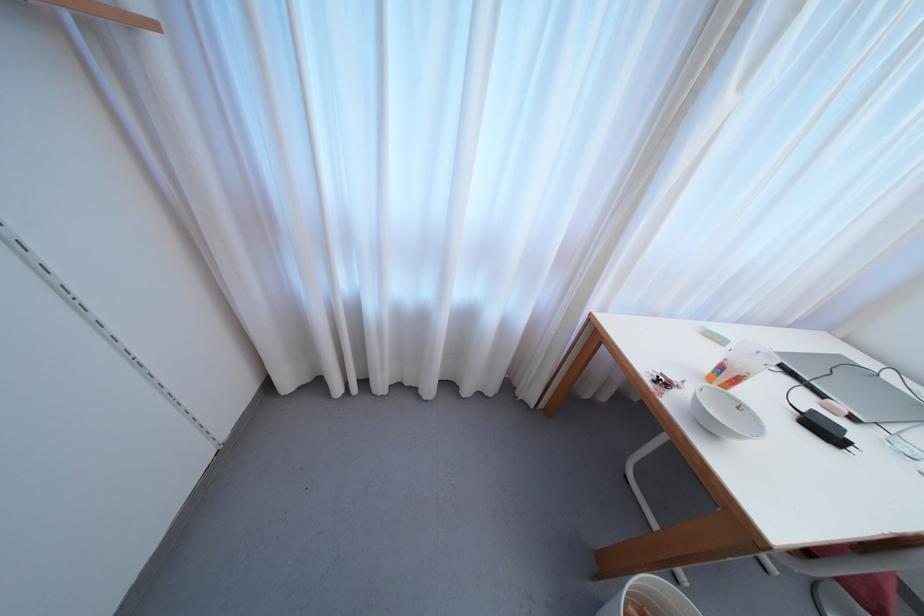
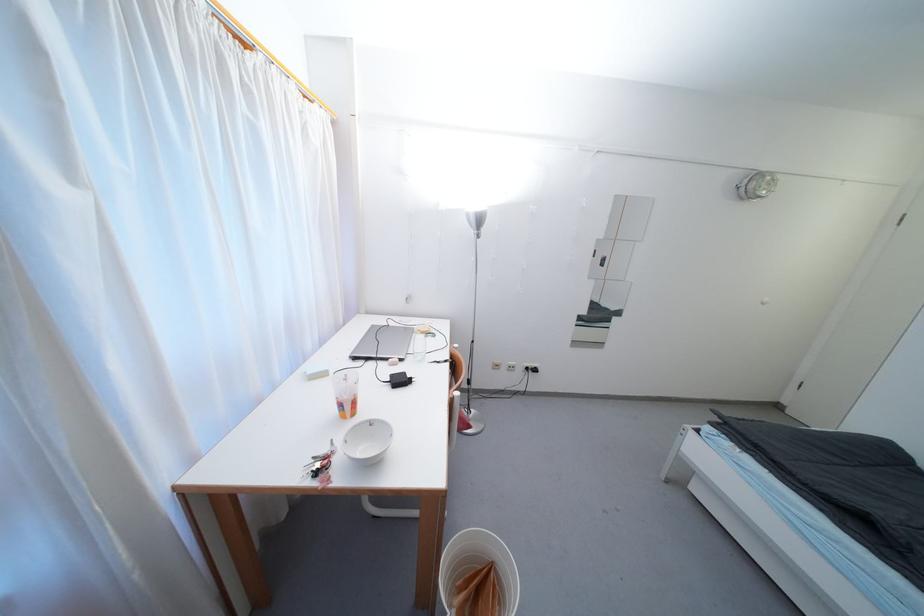
The images are taken continuously from a first-person perspective. In which direction is your viewpoint rotating?

The camera's rotation is toward right-down.